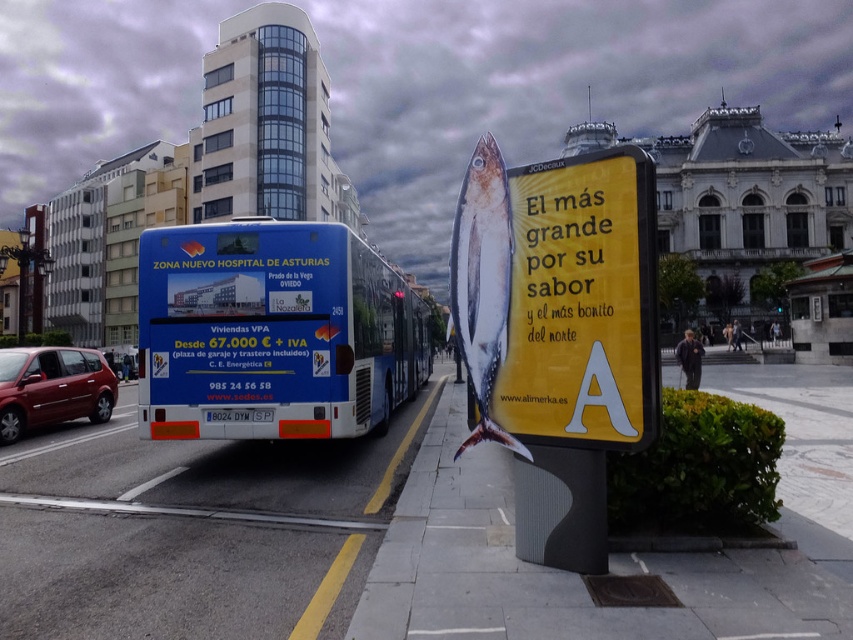
You are standing on the sidewalk and see both the yellow paperboard sign at center and the blue metallic bus at center. Which object is nearer to you?

The yellow paperboard sign at center is closer to the viewer than the blue metallic bus at center.

You are standing on the sidewalk next to the blue bus. You want to read the yellow paperboard sign at center but you can only walk 5 meters. Can you reach it?

The distance between the blue bus and the yellow paperboard sign at center is 5.29 meters, so you cannot reach it within 5 meters.